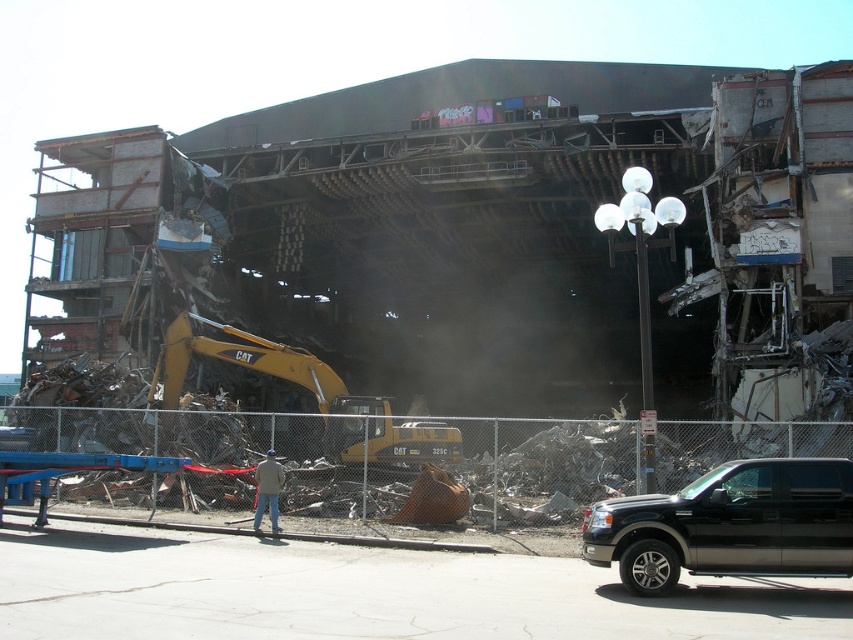
Question: Which point is closer to the camera taking this photo?

Choices:
 (A) (265, 483)
 (B) (851, 467)

Answer: (B)

Question: Can you confirm if black matte suv at lower right is positioned below yellow metallic excavator at left?

Choices:
 (A) no
 (B) yes

Answer: (B)

Question: Observing the image, what is the correct spatial positioning of black matte suv at lower right in reference to yellow metallic excavator at left?

Choices:
 (A) left
 (B) right

Answer: (B)

Question: Which object is positioned closest to the yellow metallic excavator at left?

Choices:
 (A) black matte suv at lower right
 (B) khaki fabric jacket at center

Answer: (B)

Question: Can you confirm if black matte suv at lower right is smaller than khaki fabric jacket at center?

Choices:
 (A) no
 (B) yes

Answer: (A)

Question: Which point is closer to the camera?

Choices:
 (A) yellow metallic excavator at left
 (B) khaki fabric jacket at center
 (C) black matte suv at lower right

Answer: (C)